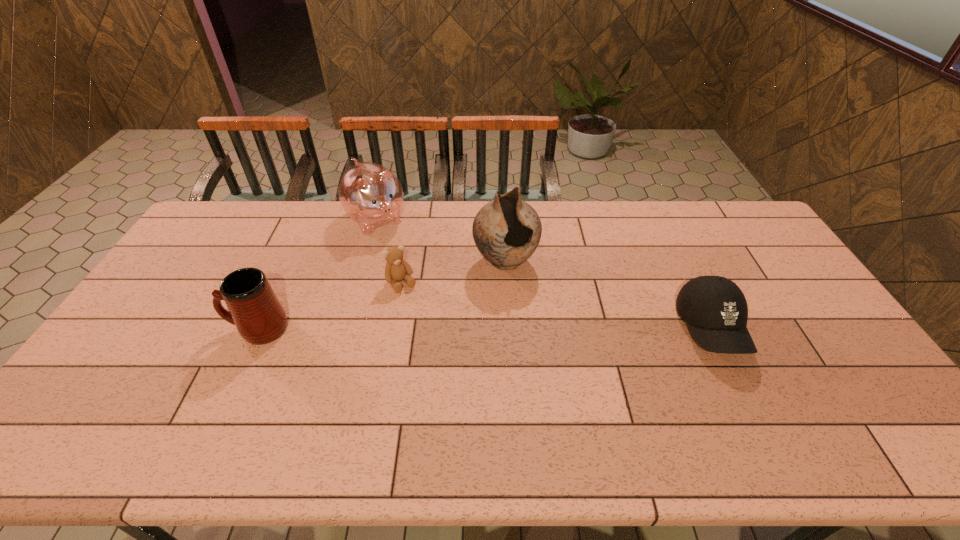
Locate an element on the screen. the third tallest object is located at coordinates (255, 310).

The height and width of the screenshot is (540, 960). Identify the location of mug. (255, 310).

Identify the location of the rightmost object. (716, 309).

The image size is (960, 540). I want to click on teddy bear, so click(396, 269).

Identify the location of the farthest object. coord(371,195).

This screenshot has width=960, height=540. I want to click on piggy bank, so click(371, 195).

Find the location of `pottery`. pottery is located at coordinates (507, 230).

Find the location of a particular element. The image size is (960, 540). the second object from right to left is located at coordinates (x=507, y=230).

At what (x,y) coordinates should I click in order to perform the action: click on vacant position located on the side of the third shortest object with the handle. Please return your answer as a coordinate pair (x, y). This screenshot has height=540, width=960. Looking at the image, I should click on (157, 329).

This screenshot has height=540, width=960. I want to click on vacant area located on the side of the third shortest object with the handle, so click(x=140, y=329).